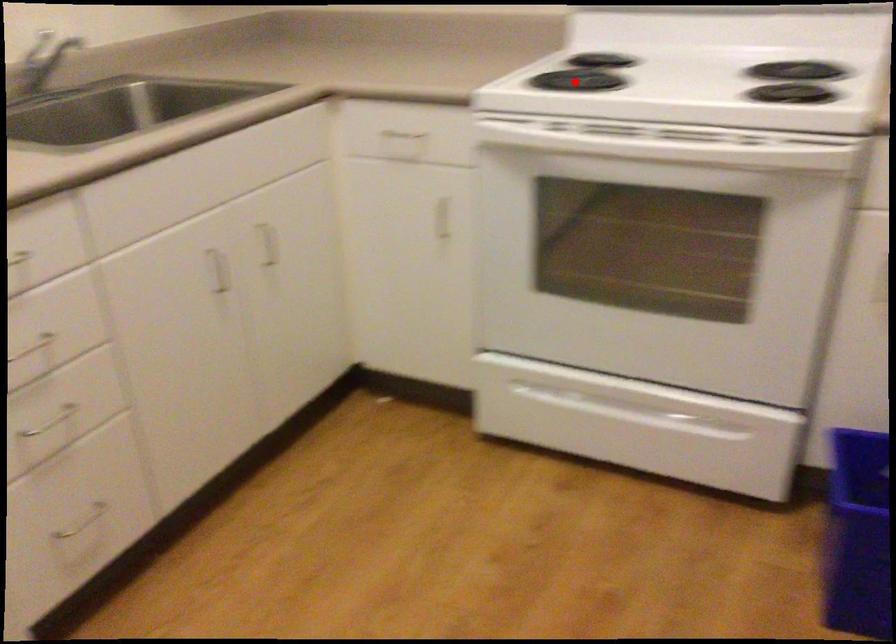
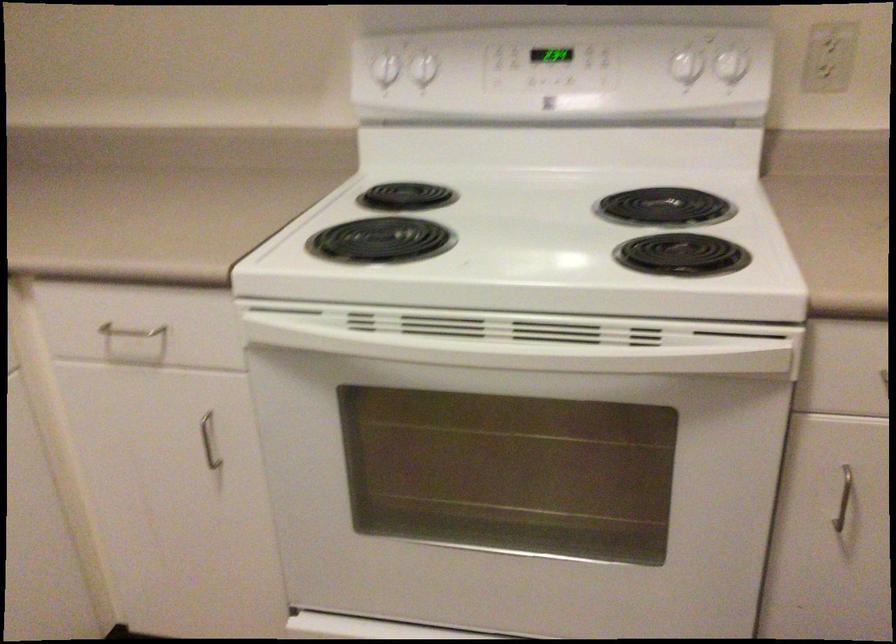
Locate, in the second image, the point that corresponds to the highlighted location in the first image.

(380, 240)